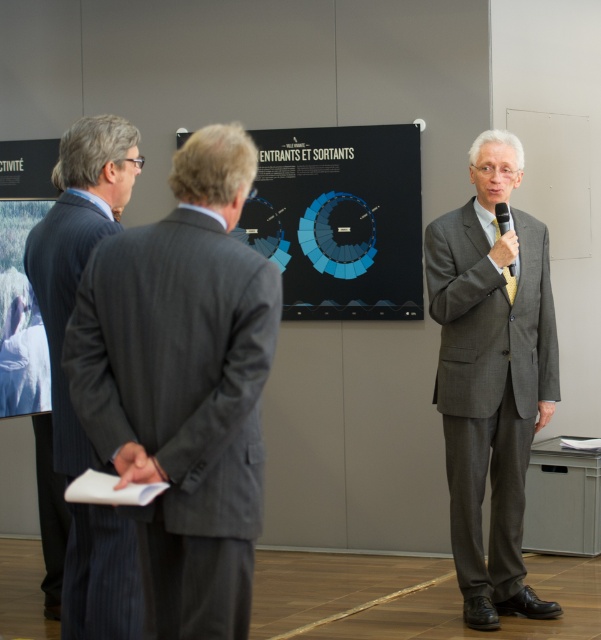
Which of these two, gray pinstripe suit at left or pinstriped wool suit at left, stands taller?

pinstriped wool suit at left is taller.

Can you confirm if gray pinstripe suit at left is positioned to the right of pinstriped wool suit at left?

Correct, you'll find gray pinstripe suit at left to the right of pinstriped wool suit at left.

Locate an element on the screen. This screenshot has width=601, height=640. gray pinstripe suit at left is located at coordinates (183, 385).

You are a GUI agent. You are given a task and a screenshot of the screen. Output one action in this format:
    pyautogui.click(x=<x>, y=<y>)
    Task: Click on the gray pinstripe suit at left
    This screenshot has height=640, width=601.
    Given the screenshot: What is the action you would take?
    pyautogui.click(x=183, y=385)

Measure the distance between point (x=130, y=332) and camera.

Point (x=130, y=332) is 9.06 feet from camera.

Where is `gray pinstripe suit at left`? The width and height of the screenshot is (601, 640). gray pinstripe suit at left is located at coordinates (183, 385).

The height and width of the screenshot is (640, 601). What do you see at coordinates (492, 374) in the screenshot?
I see `gray suit at center` at bounding box center [492, 374].

Based on the photo, can you confirm if gray suit at center is smaller than pinstriped wool suit at left?

Actually, gray suit at center might be larger than pinstriped wool suit at left.

Is point (495, 557) positioned in front of point (75, 266)?

No, it is behind (75, 266).

This screenshot has width=601, height=640. Find the location of `gray suit at center`. gray suit at center is located at coordinates click(x=492, y=374).